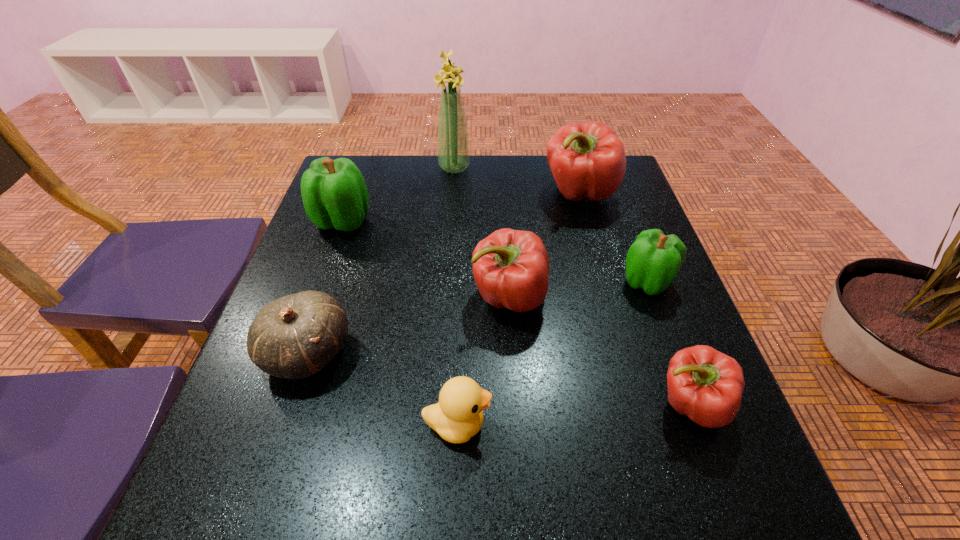
Select which object appears as the fifth closest to the biggest pink bell pepper. Please provide its 2D coordinates. Your answer should be formatted as a tuple, i.e. [(x, y)], where the tuple contains the x and y coordinates of a point satisfying the conditions above.

[(704, 384)]

Identify which object is the fifth closest to the gourd. Please provide its 2D coordinates. Your answer should be formatted as a tuple, i.e. [(x, y)], where the tuple contains the x and y coordinates of a point satisfying the conditions above.

[(704, 384)]

Image resolution: width=960 pixels, height=540 pixels. What are the coordinates of `bell pepper that is the second closest to the smallest pink bell pepper` in the screenshot? It's located at (511, 267).

At what (x,y) coordinates should I click in order to perform the action: click on the closest bell pepper to the yellow duck. Please return your answer as a coordinate pair (x, y). The height and width of the screenshot is (540, 960). Looking at the image, I should click on (511, 267).

Where is `the second closest pink bell pepper to the smaller green bell pepper`? This screenshot has height=540, width=960. the second closest pink bell pepper to the smaller green bell pepper is located at coordinates (704, 384).

At what (x,y) coordinates should I click in order to perform the action: click on pink bell pepper identified as the third closest to the gourd. Please return your answer as a coordinate pair (x, y). The image size is (960, 540). Looking at the image, I should click on (704, 384).

The width and height of the screenshot is (960, 540). Identify the location of free location that satisfies the following two spatial constraints: 1. on the front-facing side of the green bouquet; 2. on the back side of the nearest pink bell pepper. (436, 404).

I want to click on free spot that satisfies the following two spatial constraints: 1. on the front-facing side of the nearer green bell pepper; 2. on the right side of the green bouquet, so click(445, 282).

You are a GUI agent. You are given a task and a screenshot of the screen. Output one action in this format:
    pyautogui.click(x=<x>, y=<y>)
    Task: Click on the vacant point that satisfies the following two spatial constraints: 1. on the front-facing side of the green bouquet; 2. on the back side of the right green bell pepper
    The height and width of the screenshot is (540, 960).
    Given the screenshot: What is the action you would take?
    pyautogui.click(x=445, y=282)